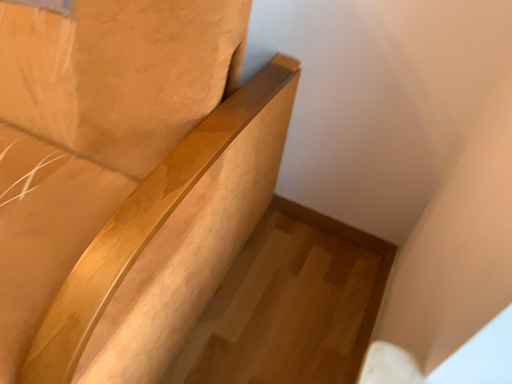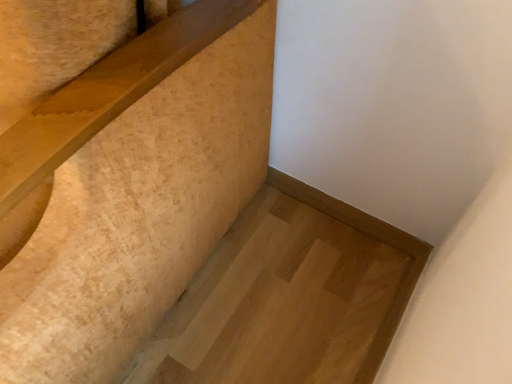
Question: Which way did the camera rotate in the video?

Choices:
 (A) rotated left
 (B) rotated right

Answer: (A)